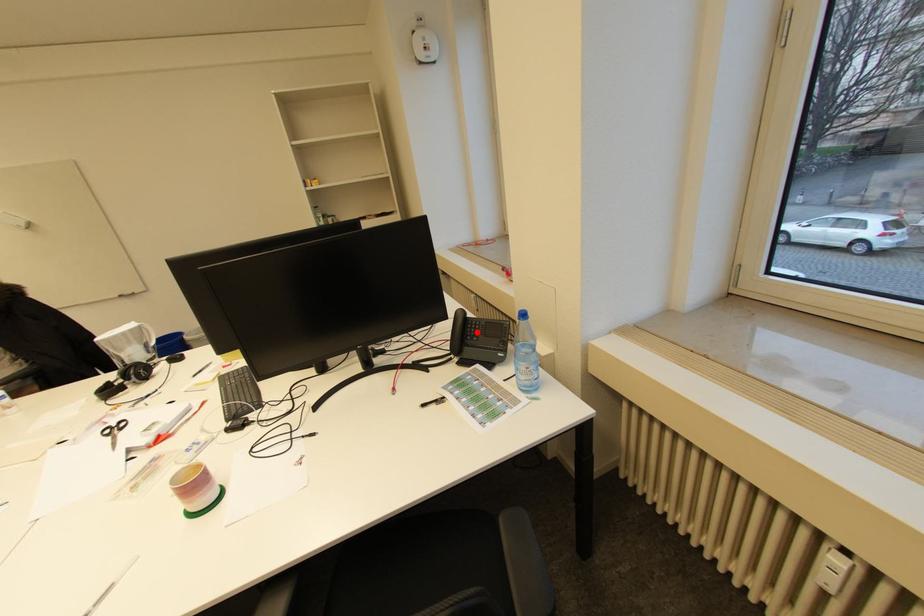
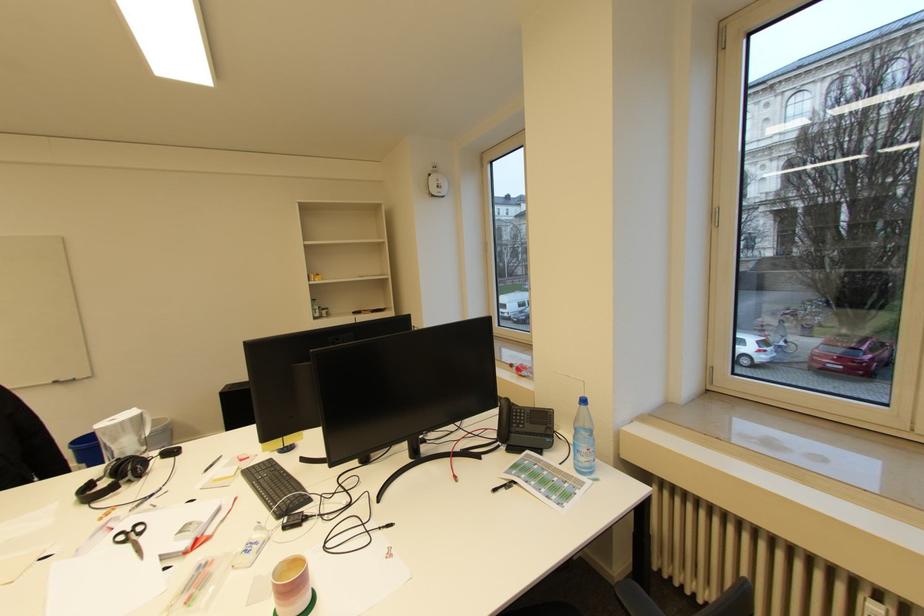
In the second image, find the point that corresponds to the highlighted location in the first image.

(523, 419)